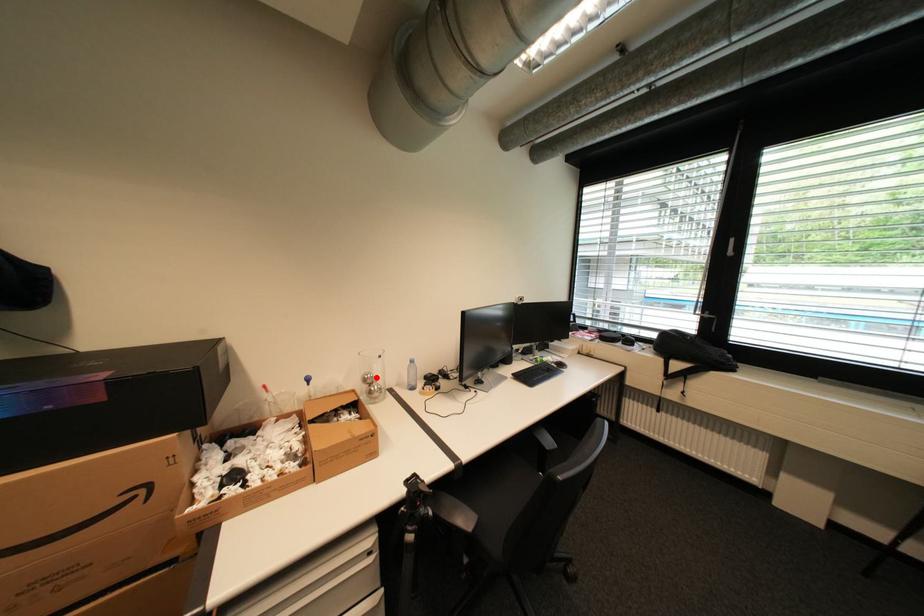
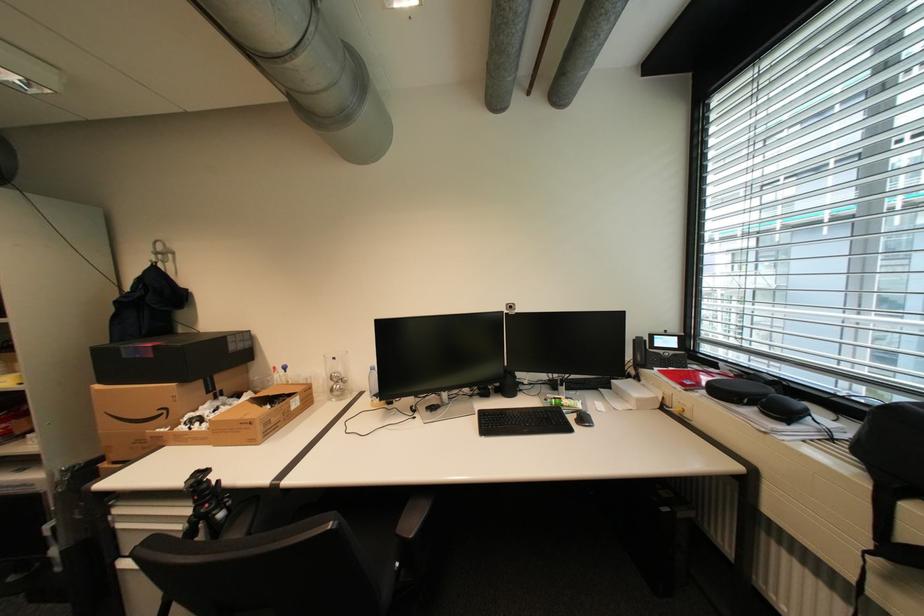
Where in the second image is the point corresponding to the highlighted location from the first image?

(343, 376)